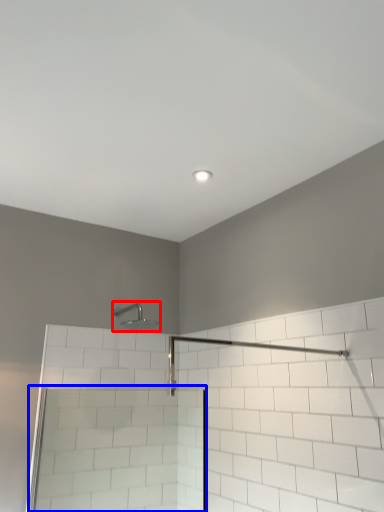
Question: Which object is closer to the camera taking this photo, shower (highlighted by a red box) or screen door (highlighted by a blue box)?

Choices:
 (A) shower
 (B) screen door

Answer: (B)